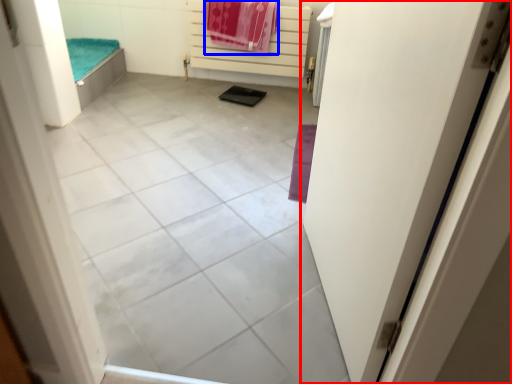
Question: Among these objects, which one is nearest to the camera, door (highlighted by a red box) or beach towel (highlighted by a blue box)?

Choices:
 (A) door
 (B) beach towel

Answer: (A)